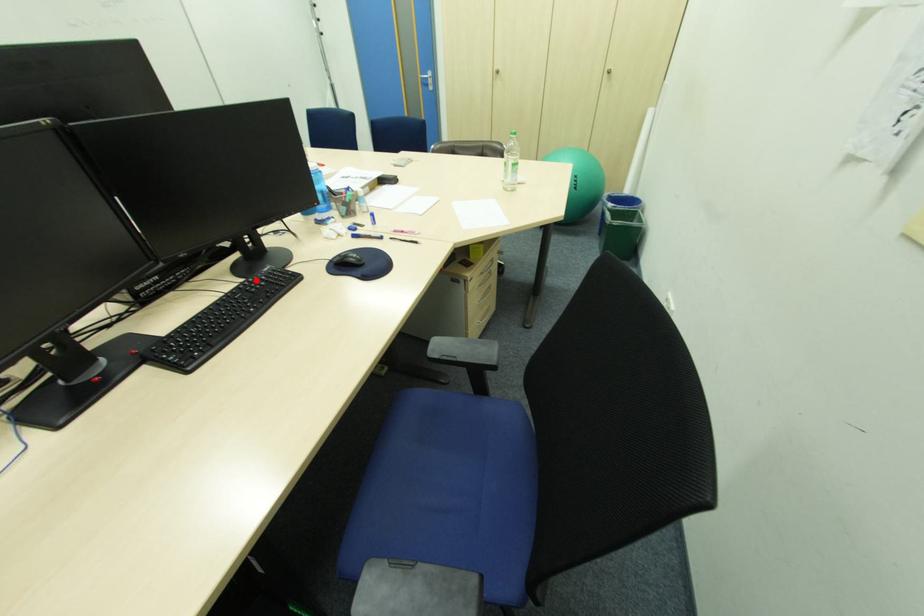
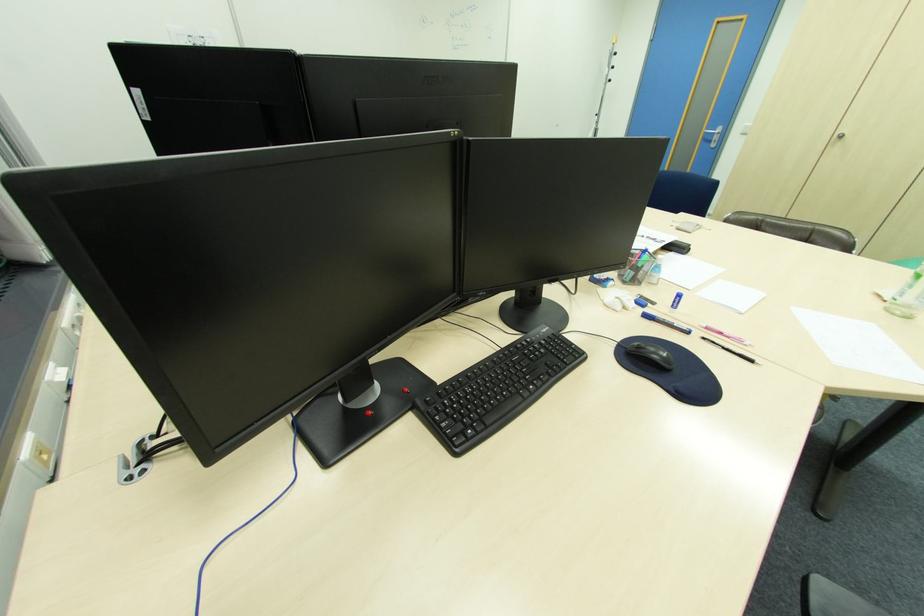
The point at the highlighted location is marked in the first image. Where is the corresponding point in the second image?

(533, 339)